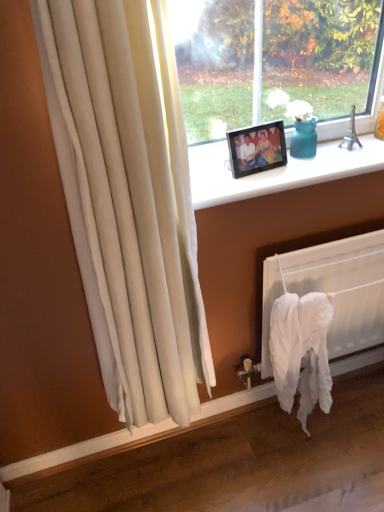
The height and width of the screenshot is (512, 384). Identify the location of vacant space to the right of black plastic picture frame at upper center. (313, 166).